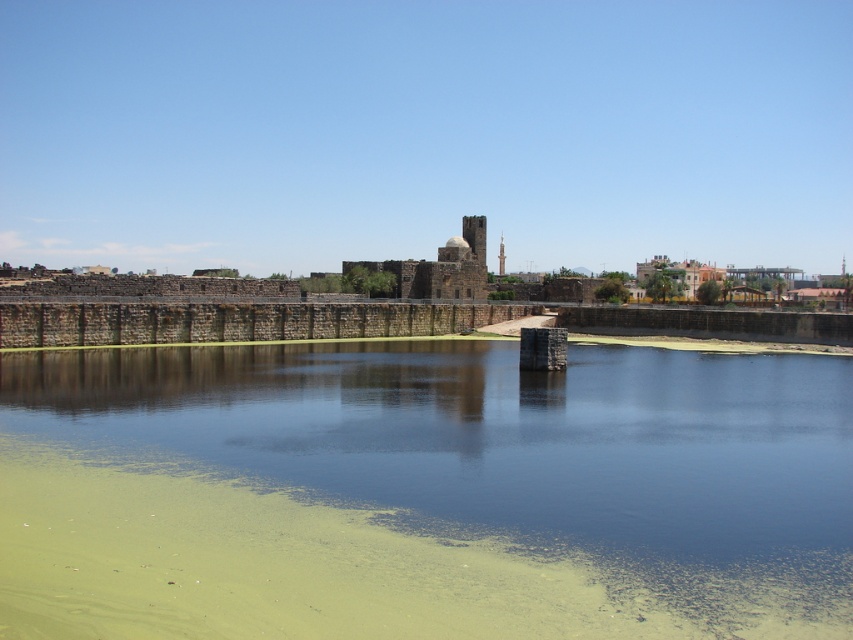
Does green algae-covered water at center have a greater height compared to dark brown stone fort at center?

No.

Is point (90, 468) positioned in front of point (381, 262)?

Yes, point (90, 468) is closer to viewer.

This screenshot has width=853, height=640. Identify the location of green algae-covered water at center. click(422, 492).